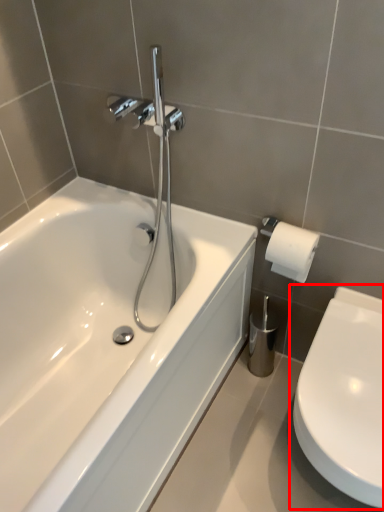
Question: From the image's perspective, what is the correct spatial relationship of toilet (annotated by the red box) in relation to bathtub?

Choices:
 (A) below
 (B) above

Answer: (A)